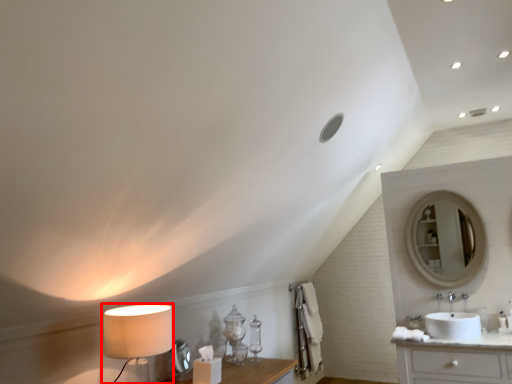
Question: Where is table lamp (annotated by the red box) located in relation to sink in the image?

Choices:
 (A) right
 (B) left

Answer: (B)